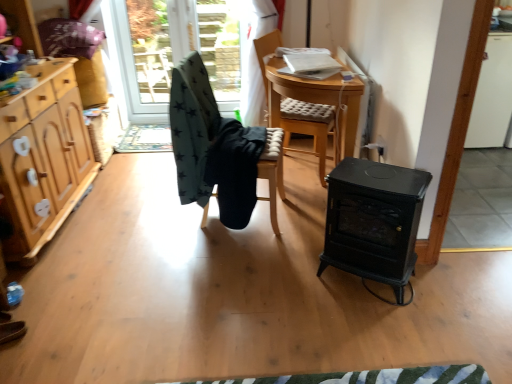
Question: Is dark green fabric chair at center, positioned as the third chair in right-to-left order, to the left of wooden chair with cushion at center, marked as the 1th chair in a right-to-left arrangement, from the viewer's perspective?

Choices:
 (A) no
 (B) yes

Answer: (B)

Question: Is wooden chair with cushion at center, the 3th chair positioned from the left, surrounded by dark green fabric chair at center, which is the 1th chair from left to right?

Choices:
 (A) yes
 (B) no

Answer: (B)

Question: Is the depth of dark green fabric chair at center, positioned as the third chair in right-to-left order, greater than that of wooden chair with cushion at center, the 3th chair positioned from the left?

Choices:
 (A) no
 (B) yes

Answer: (A)

Question: Is dark green fabric chair at center, positioned as the third chair in right-to-left order, shorter than wooden chair with cushion at center, the 3th chair positioned from the left?

Choices:
 (A) yes
 (B) no

Answer: (B)

Question: Is dark green fabric chair at center, which is the 1th chair from left to right, taller than wooden chair with cushion at center, marked as the 1th chair in a right-to-left arrangement?

Choices:
 (A) yes
 (B) no

Answer: (A)

Question: Is black fabric chair at center, marked as the 2th chair in a right-to-left arrangement, bigger or smaller than black cast iron stove at center?

Choices:
 (A) small
 (B) big

Answer: (B)

Question: From a real-world perspective, is black fabric chair at center, marked as the 2th chair in a right-to-left arrangement, above or below black cast iron stove at center?

Choices:
 (A) above
 (B) below

Answer: (A)

Question: Considering the positions of black fabric chair at center, the 2th chair positioned from the left, and black cast iron stove at center in the image, is black fabric chair at center, the 2th chair positioned from the left, wider or thinner than black cast iron stove at center?

Choices:
 (A) thin
 (B) wide

Answer: (B)

Question: In the image, is black fabric chair at center, marked as the 2th chair in a right-to-left arrangement, on the left side or the right side of black cast iron stove at center?

Choices:
 (A) right
 (B) left

Answer: (B)

Question: Does point (181, 112) appear closer or farther from the camera than point (344, 231)?

Choices:
 (A) farther
 (B) closer

Answer: (A)

Question: Considering the positions of dark green fabric chair at center, positioned as the third chair in right-to-left order, and black cast iron stove at center in the image, is dark green fabric chair at center, positioned as the third chair in right-to-left order, wider or thinner than black cast iron stove at center?

Choices:
 (A) thin
 (B) wide

Answer: (B)

Question: Is dark green fabric chair at center, which is the 1th chair from left to right, in front of or behind black cast iron stove at center in the image?

Choices:
 (A) behind
 (B) front

Answer: (A)

Question: In terms of height, does dark green fabric chair at center, positioned as the third chair in right-to-left order, look taller or shorter compared to black cast iron stove at center?

Choices:
 (A) short
 (B) tall

Answer: (B)

Question: Visually, is wooden cabinet at left positioned to the left or to the right of transparent glass door at upper center, marked as the first window screen in a left-to-right arrangement?

Choices:
 (A) left
 (B) right

Answer: (A)

Question: Considering the positions of wooden cabinet at left and transparent glass door at upper center, the 2th window screen in the right-to-left sequence, in the image, is wooden cabinet at left wider or thinner than transparent glass door at upper center, the 2th window screen in the right-to-left sequence,?

Choices:
 (A) wide
 (B) thin

Answer: (A)